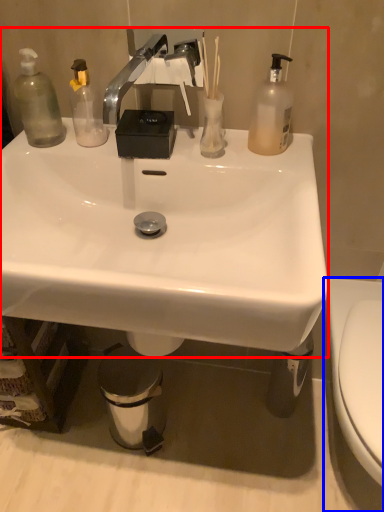
Question: Which of the following is the closest to the observer, sink (highlighted by a red box) or toilet (highlighted by a blue box)?

Choices:
 (A) sink
 (B) toilet

Answer: (B)